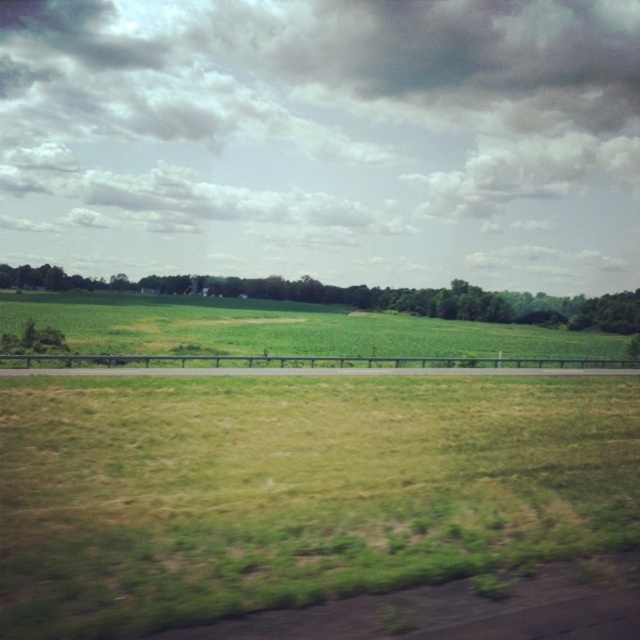
Does green grassy field at lower center have a lesser width compared to green leafy tree at center?

Yes.

How distant is green grassy field at lower center from green leafy tree at center?

The distance of green grassy field at lower center from green leafy tree at center is 146.14 meters.

Between point (634, 515) and point (278, 298), which one is positioned behind?

The point (278, 298) is more distant.

You are a GUI agent. You are given a task and a screenshot of the screen. Output one action in this format:
    pyautogui.click(x=<x>, y=<y>)
    Task: Click on the green grassy field at lower center
    The width and height of the screenshot is (640, 640).
    Given the screenshot: What is the action you would take?
    pyautogui.click(x=294, y=490)